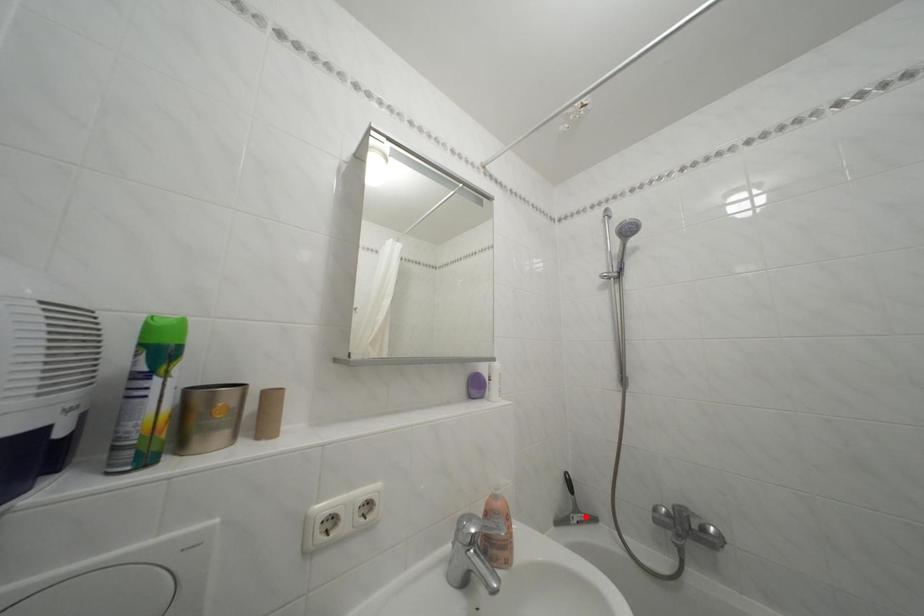
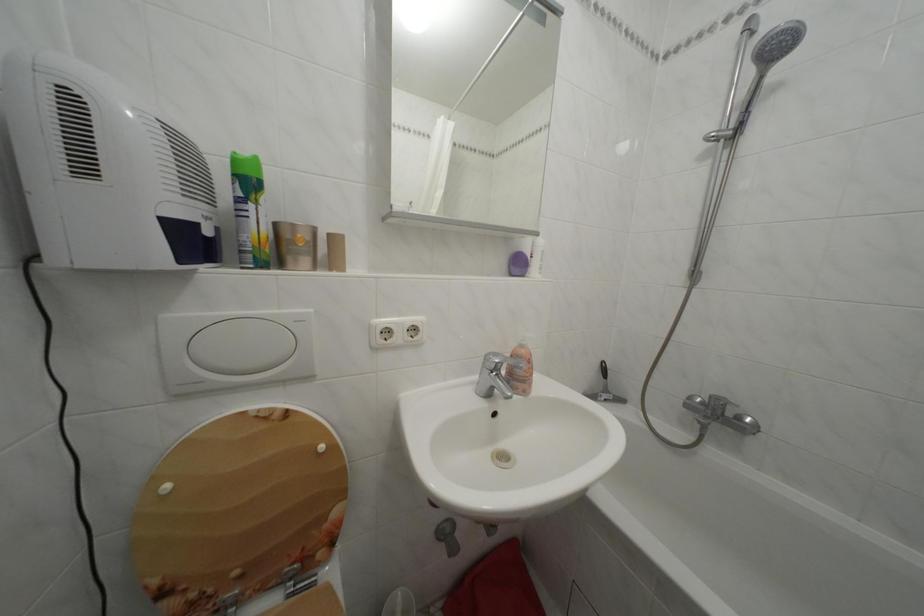
Locate, in the second image, the point that corresponds to the highlighted location in the first image.

(614, 397)